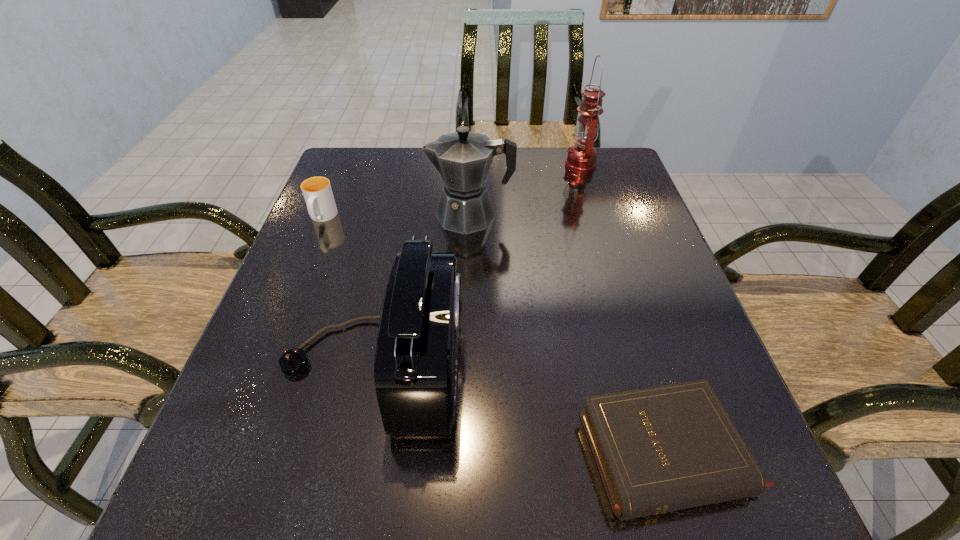
Locate an element on the screen. The height and width of the screenshot is (540, 960). free space that satisfies the following two spatial constraints: 1. at the spout of the coffeepot; 2. with the handle on the side of the leftmost object is located at coordinates tap(470, 218).

Locate an element on the screen. free region that satisfies the following two spatial constraints: 1. at the spout of the shortest object; 2. on the right side of the coffeepot is located at coordinates (465, 454).

Where is `free spot that satisfies the following two spatial constraints: 1. at the spout of the coffeepot; 2. with the handle on the side of the leftmost object`? free spot that satisfies the following two spatial constraints: 1. at the spout of the coffeepot; 2. with the handle on the side of the leftmost object is located at coordinates (470, 218).

The height and width of the screenshot is (540, 960). Identify the location of vacant space that satisfies the following two spatial constraints: 1. at the spout of the coffeepot; 2. with the handle on the side of the leftmost object. (470, 218).

Image resolution: width=960 pixels, height=540 pixels. Find the location of `free space that satisfies the following two spatial constraints: 1. on the front side of the farthest object; 2. on the front-facing side of the radio receiver`. free space that satisfies the following two spatial constraints: 1. on the front side of the farthest object; 2. on the front-facing side of the radio receiver is located at coordinates (640, 361).